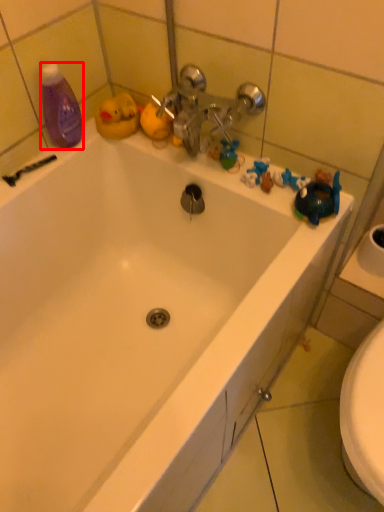
Question: From the image, what is the correct spatial relationship of cleaning product (annotated by the red box) in relation to shower?

Choices:
 (A) right
 (B) left

Answer: (A)